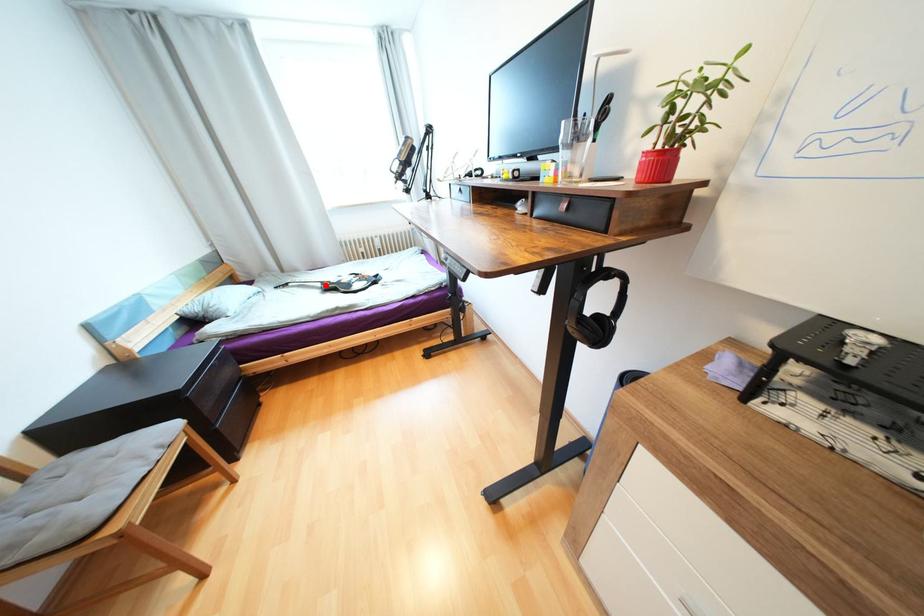
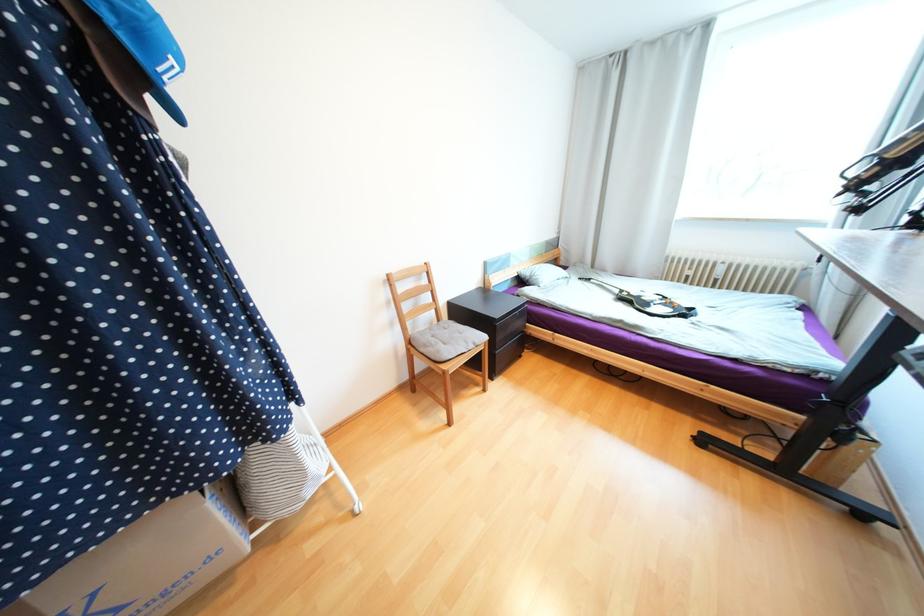
Question: I am providing you with two images of the same scene from different viewpoints. Given a red point in image1, look at the same physical point in image2. Is it:

Choices:
 (A) Closer to the viewpoint
 (B) Farther from the viewpoint

Answer: (B)